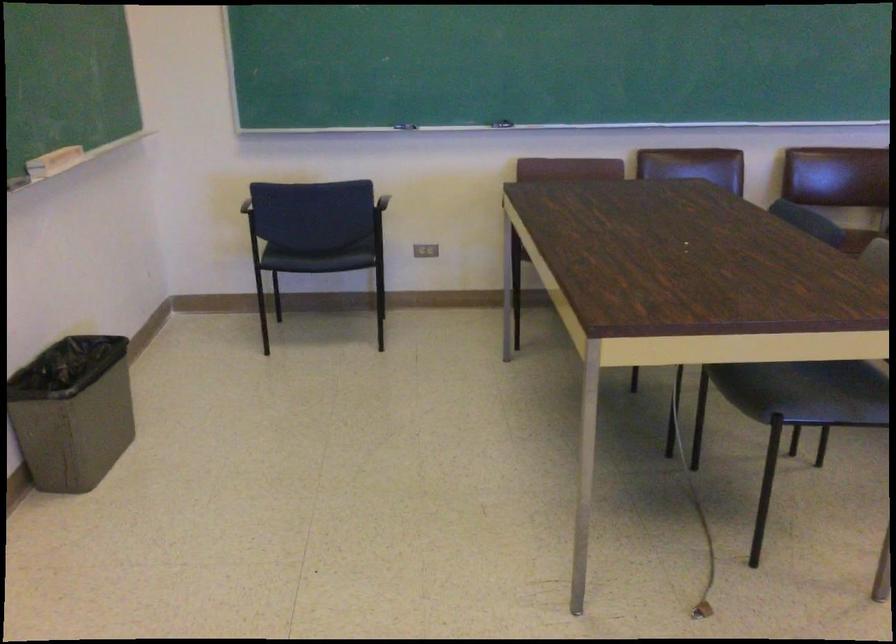
What do you see at coordinates (857, 240) in the screenshot? I see `the brown chair sitting surface` at bounding box center [857, 240].